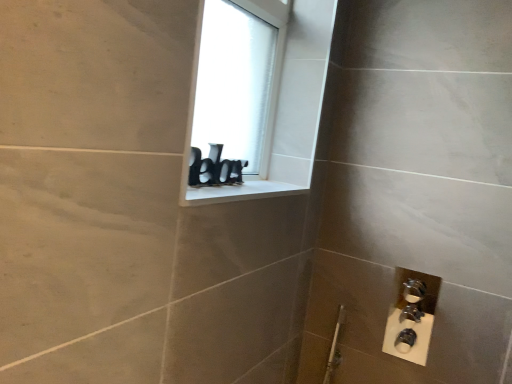
What do you see at coordinates (237, 81) in the screenshot?
I see `white matte window screen at upper center` at bounding box center [237, 81].

Locate an element on the screen. white matte window screen at upper center is located at coordinates (237, 81).

In order to face white glossy window sill at upper center, should I rotate leftwards or rightwards?

It's best to rotate left around 1.877 degrees.

What do you see at coordinates (239, 192) in the screenshot? This screenshot has height=384, width=512. I see `white glossy window sill at upper center` at bounding box center [239, 192].

Locate an element on the screen. This screenshot has width=512, height=384. white glossy window sill at upper center is located at coordinates (239, 192).

Measure the distance between white glossy window sill at upper center and camera.

white glossy window sill at upper center is 32.64 inches from camera.

At what (x,y) coordinates should I click in order to perform the action: click on white matte window screen at upper center. Please return your answer as a coordinate pair (x, y). The width and height of the screenshot is (512, 384). Looking at the image, I should click on (237, 81).

Can you confirm if white matte window screen at upper center is positioned to the right of white glossy window sill at upper center?

Incorrect, white matte window screen at upper center is not on the right side of white glossy window sill at upper center.

Which is in front, white matte window screen at upper center or white glossy window sill at upper center?

white glossy window sill at upper center is in front.

Does point (245, 6) lie behind point (232, 194)?

Yes, point (245, 6) is behind point (232, 194).

Based on the photo, from the image's perspective, which one is positioned lower, white matte window screen at upper center or white glossy window sill at upper center?

From the image's view, white glossy window sill at upper center is below.

From a real-world perspective, relative to white glossy window sill at upper center, is white matte window screen at upper center vertically above or below?

From a real-world perspective, white matte window screen at upper center is physically above white glossy window sill at upper center.

Is white matte window screen at upper center thinner than white glossy window sill at upper center?

Indeed, white matte window screen at upper center has a lesser width compared to white glossy window sill at upper center.

Who is taller, white matte window screen at upper center or white glossy window sill at upper center?

With more height is white matte window screen at upper center.

Between white matte window screen at upper center and white glossy window sill at upper center, which one has larger size?

white matte window screen at upper center is bigger.

Is white glossy window sill at upper center a part of white matte window screen at upper center?

No.

Is white matte window screen at upper center touching white glossy window sill at upper center?

white matte window screen at upper center and white glossy window sill at upper center are not in contact.

Is white matte window screen at upper center oriented away from white glossy window sill at upper center?

white matte window screen at upper center does not have its back to white glossy window sill at upper center.

How different are the orientations of white matte window screen at upper center and white glossy window sill at upper center in degrees?

0.672 degrees.

Measure the distance from white matte window screen at upper center to white glossy window sill at upper center.

11.70 inches.

You are a GUI agent. You are given a task and a screenshot of the screen. Output one action in this format:
    pyautogui.click(x=<x>, y=<y>)
    Task: Click on the window sill that is under the white matte window screen at upper center (from a real-world perspective)
    Image resolution: width=512 pixels, height=384 pixels.
    Given the screenshot: What is the action you would take?
    pyautogui.click(x=239, y=192)

Considering the relative positions of white glossy window sill at upper center and white matte window screen at upper center in the image provided, is white glossy window sill at upper center to the left or to the right of white matte window screen at upper center?

white glossy window sill at upper center is to the right of white matte window screen at upper center.

Considering the positions of objects white glossy window sill at upper center and white matte window screen at upper center in the image provided, who is behind, white glossy window sill at upper center or white matte window screen at upper center?

white matte window screen at upper center is behind.

Is point (286, 191) closer to camera compared to point (237, 139)?

Yes.

From the image's perspective, is white glossy window sill at upper center on white matte window screen at upper center?

Actually, white glossy window sill at upper center appears below white matte window screen at upper center in the image.

From a real-world perspective, is white glossy window sill at upper center located higher than white matte window screen at upper center?

No, from a real-world perspective, white glossy window sill at upper center is not over white matte window screen at upper center

Which of these two, white glossy window sill at upper center or white matte window screen at upper center, is thinner?

white matte window screen at upper center.

Considering the relative sizes of white glossy window sill at upper center and white matte window screen at upper center in the image provided, is white glossy window sill at upper center taller than white matte window screen at upper center?

No.

Considering the relative sizes of white glossy window sill at upper center and white matte window screen at upper center in the image provided, is white glossy window sill at upper center smaller than white matte window screen at upper center?

Yes.

Is white matte window screen at upper center a part of white glossy window sill at upper center?

That's incorrect, white matte window screen at upper center is not inside white glossy window sill at upper center.

Is there a large distance between white glossy window sill at upper center and white matte window screen at upper center?

No, white glossy window sill at upper center is not far away from white matte window screen at upper center.

Is white glossy window sill at upper center turned away from white matte window screen at upper center?

No.

How many degrees apart are the facing directions of white glossy window sill at upper center and white matte window screen at upper center?

There is a 0.672-degree angle between the facing directions of white glossy window sill at upper center and white matte window screen at upper center.

How far apart are white glossy window sill at upper center and white matte window screen at upper center?

A distance of 11.70 inches exists between white glossy window sill at upper center and white matte window screen at upper center.

The image size is (512, 384). In order to click on window sill on the right side of white matte window screen at upper center in this screenshot , I will do `click(239, 192)`.

Where is `window sill below the white matte window screen at upper center (from the image's perspective)`? window sill below the white matte window screen at upper center (from the image's perspective) is located at coordinates click(239, 192).

Locate an element on the screen. window screen behind the white glossy window sill at upper center is located at coordinates (237, 81).